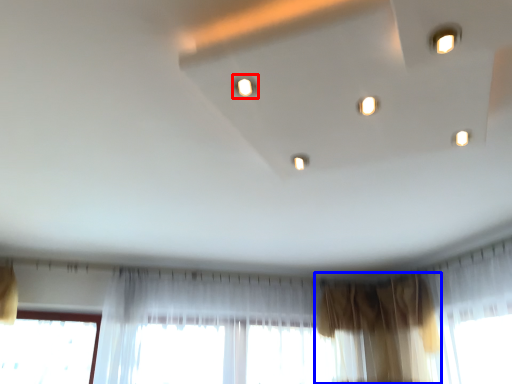
Question: Which point is further to the camera, light (highlighted by a red box) or curtain (highlighted by a blue box)?

Choices:
 (A) light
 (B) curtain

Answer: (B)